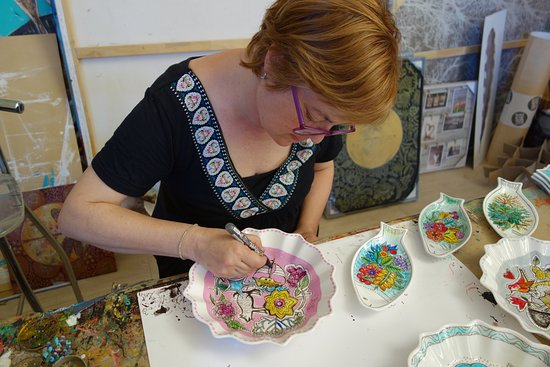
At what (x,y) coordinates should I click in order to perform the action: click on painted table top. Please return your answer as a coordinate pair (x, y). The width and height of the screenshot is (550, 367). Looking at the image, I should click on (93, 328).